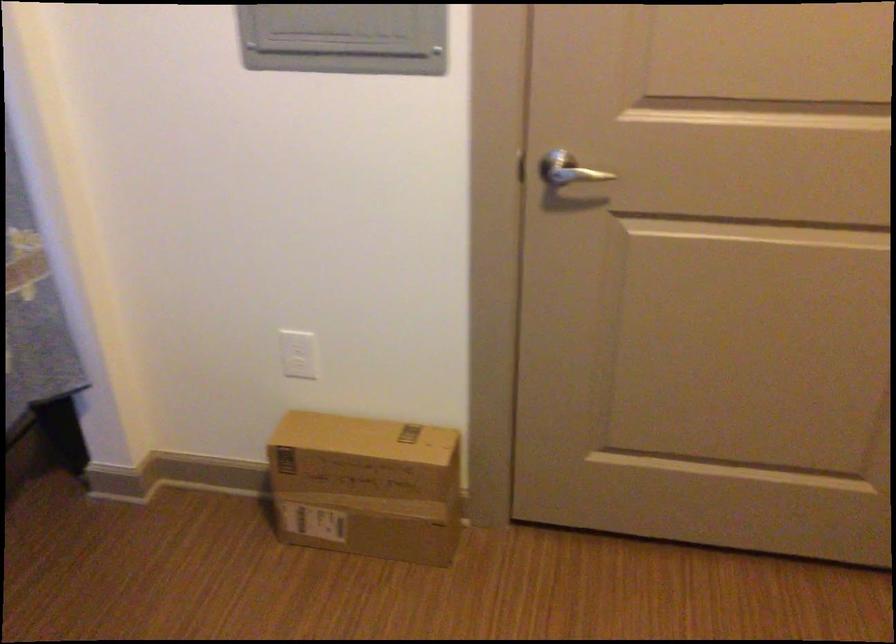
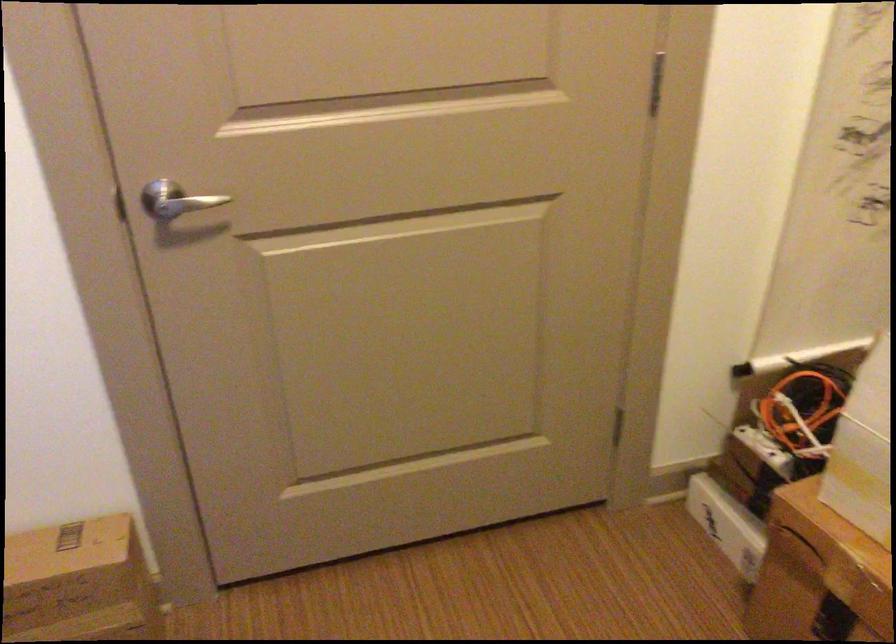
Question: Which direction would the cameraman need to move to produce the second image? Reply with the corresponding letter.

Choices:
 (A) Left
 (B) Right
 (C) Forward
 (D) Backward

Answer: (C)